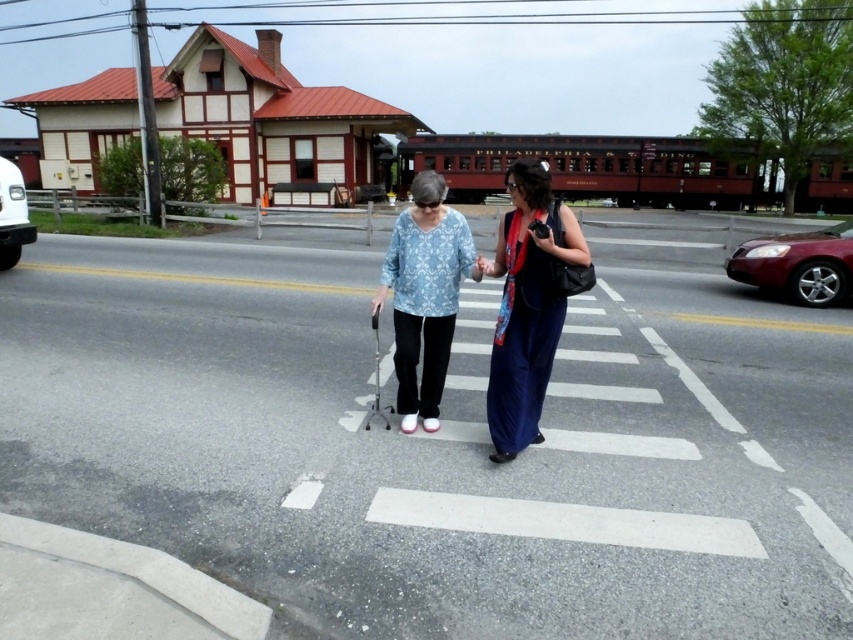
Which of these two, blue silk dress at center or light blue printed blouse at center, stands taller?

light blue printed blouse at center is taller.

Which is above, blue silk dress at center or light blue printed blouse at center?

blue silk dress at center

Who is more forward, (527, 280) or (474, 250)?

Point (527, 280) is in front.

Find the location of a particular element. blue silk dress at center is located at coordinates (526, 305).

Can you confirm if light blue printed blouse at center is thinner than white glossy van at left?

Indeed, light blue printed blouse at center has a lesser width compared to white glossy van at left.

Does light blue printed blouse at center come in front of white glossy van at left?

Yes, it is in front of white glossy van at left.

Locate an element on the screen. This screenshot has height=640, width=853. light blue printed blouse at center is located at coordinates (424, 294).

What are the coordinates of `light blue printed blouse at center` in the screenshot? It's located at (424, 294).

Is the position of shiny red sedan at right more distant than that of white glossy van at left?

No.

I want to click on shiny red sedan at right, so click(x=798, y=264).